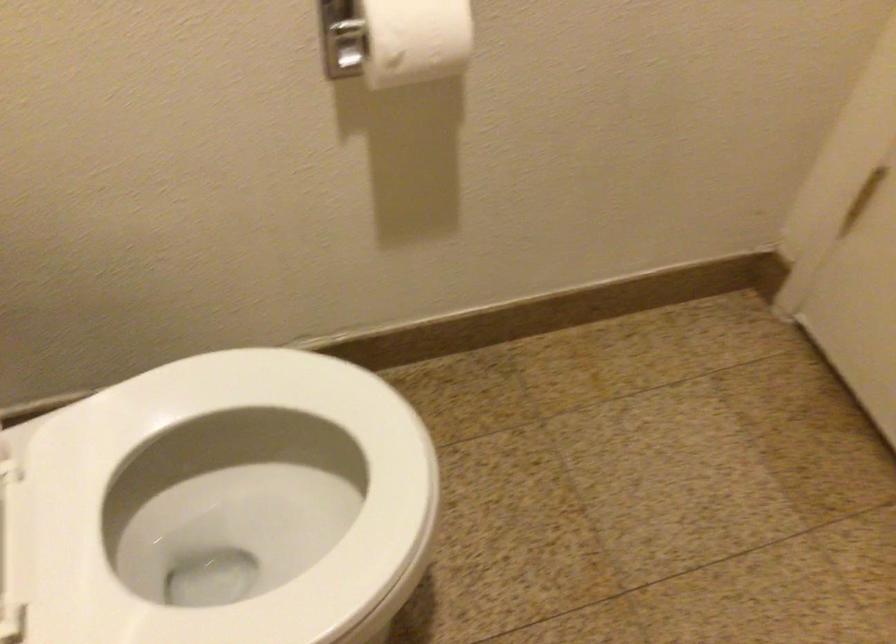
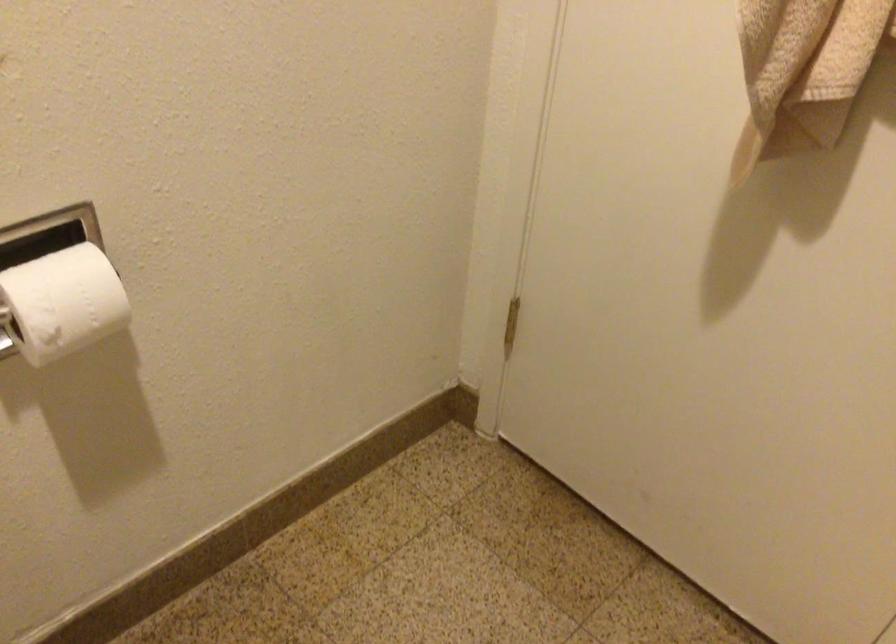
Question: The images are taken continuously from a first-person perspective. In which direction are you moving?

Choices:
 (A) Left
 (B) Right
 (C) Forward
 (D) Backward

Answer: (D)